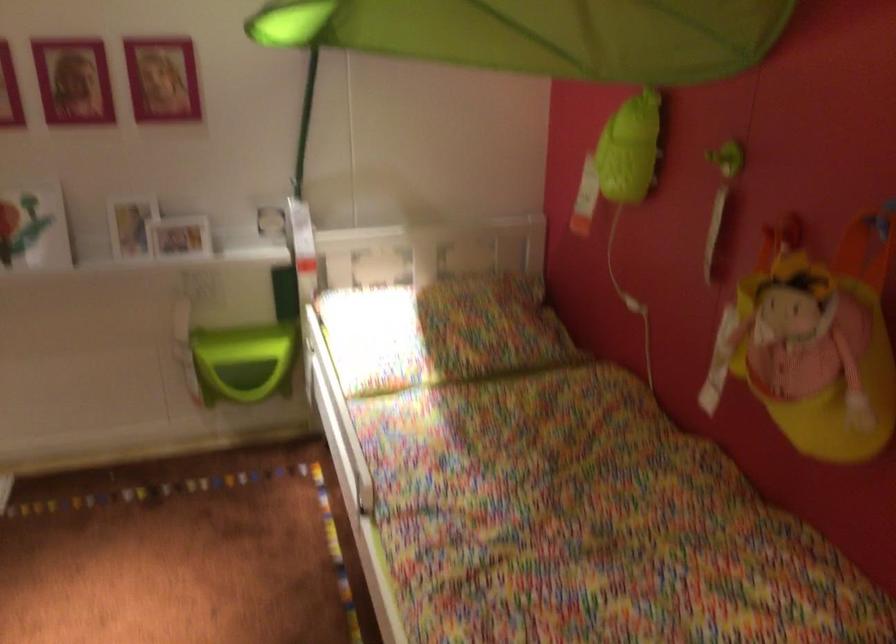
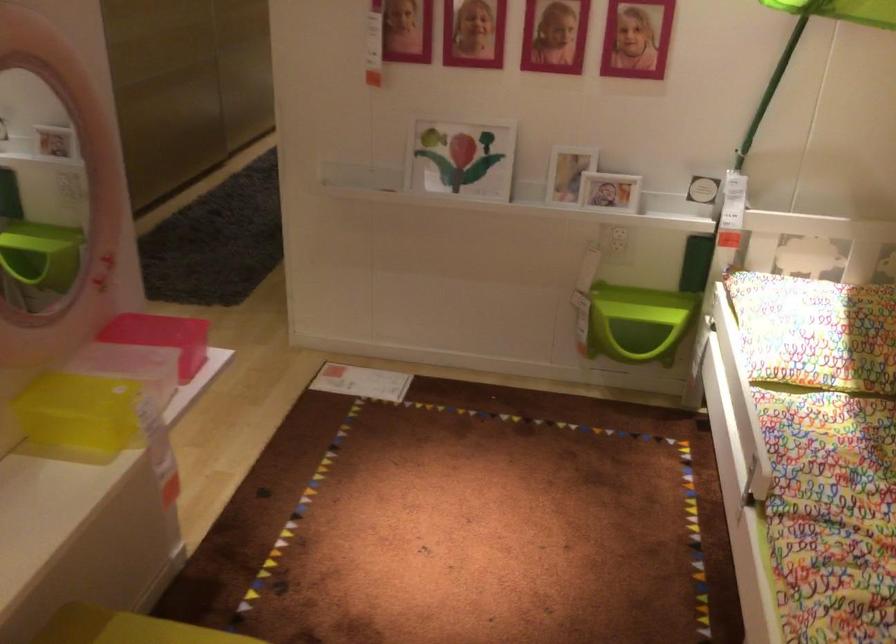
Question: Based on the continuous images, in which direction is the camera rotating? Reply with the corresponding letter.

Choices:
 (A) Left
 (B) Right
 (C) Up
 (D) Down

Answer: (A)